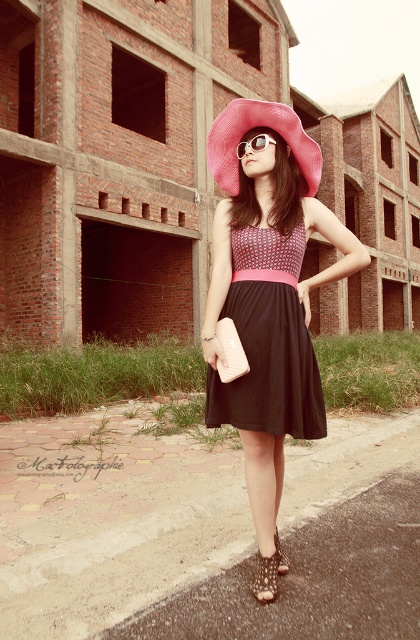
Is matte black dress at center bigger than sunglasses at center?

Yes.

Image resolution: width=420 pixels, height=640 pixels. In order to click on matte black dress at center in this screenshot , I will do `click(268, 340)`.

What are the coordinates of `matte black dress at center` in the screenshot? It's located at (268, 340).

Can you confirm if matte black dress at center is taller than leather textured sandal at lower center?

Correct, matte black dress at center is much taller as leather textured sandal at lower center.

Looking at this image, can you confirm if matte black dress at center is bigger than leather textured sandal at lower center?

Indeed, matte black dress at center has a larger size compared to leather textured sandal at lower center.

Does point (244, 307) come farther from viewer compared to point (252, 580)?

No, (244, 307) is closer to viewer.

Find the location of a particular element. matte black dress at center is located at coordinates (268, 340).

Is pink straw hat at center closer to camera compared to sunglasses at center?

Yes, pink straw hat at center is in front of sunglasses at center.

At what (x,y) coordinates should I click in order to perform the action: click on pink straw hat at center. Please return your answer as a coordinate pair (x, y). Image resolution: width=420 pixels, height=640 pixels. Looking at the image, I should click on (259, 125).

Between point (306, 172) and point (265, 138), which one is positioned in front?

Point (265, 138)

Where is `pink straw hat at center`? pink straw hat at center is located at coordinates (259, 125).